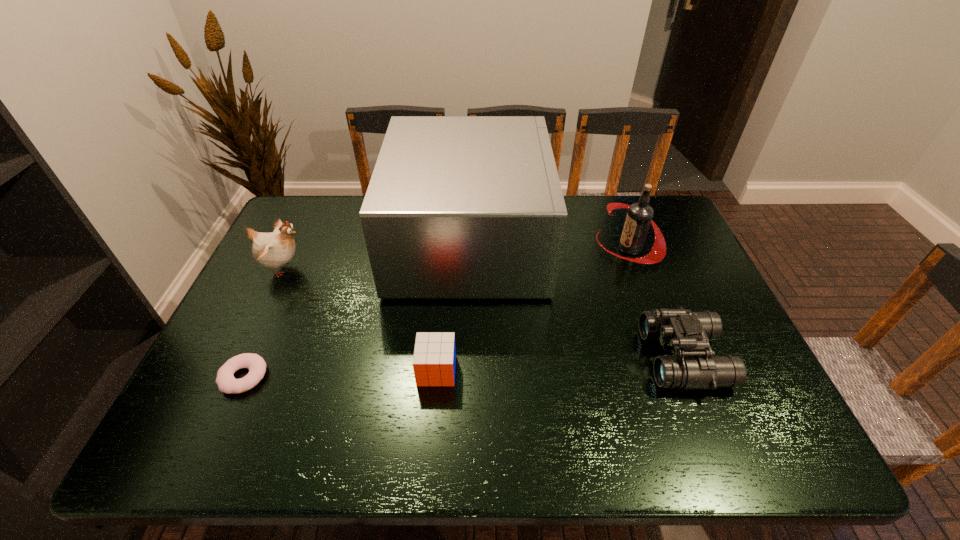
Identify the location of vacant space situated at the beak of the bird. (415, 268).

The image size is (960, 540). I want to click on free space located through the lenses of the binoculars, so click(501, 357).

Find the location of a particular element. This screenshot has width=960, height=540. free point located 0.160m through the lenses of the binoculars is located at coordinates (580, 357).

Image resolution: width=960 pixels, height=540 pixels. What are the coordinates of `vacant space located 0.380m through the lenses of the binoculars` in the screenshot? It's located at (489, 357).

The height and width of the screenshot is (540, 960). Identify the location of free space located 0.300m on the left of the second shortest object. (290, 370).

Find the location of `free space located 0.290m on the right of the doughnut`. free space located 0.290m on the right of the doughnut is located at coordinates (392, 376).

The image size is (960, 540). I want to click on microwave oven positioned at the far edge, so click(457, 206).

The image size is (960, 540). Find the location of `root beer present at the far edge`. root beer present at the far edge is located at coordinates (639, 217).

The image size is (960, 540). What are the coordinates of `bird that is at the left edge` in the screenshot? It's located at (272, 250).

The image size is (960, 540). Identify the location of doughnut that is at the left edge. (226, 382).